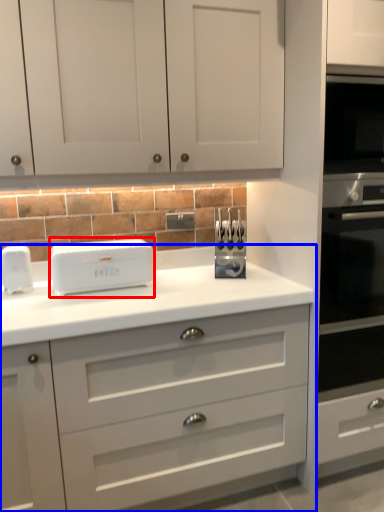
Question: Which object appears farthest to the camera in this image, home appliance (highlighted by a red box) or chest of drawers (highlighted by a blue box)?

Choices:
 (A) home appliance
 (B) chest of drawers

Answer: (A)